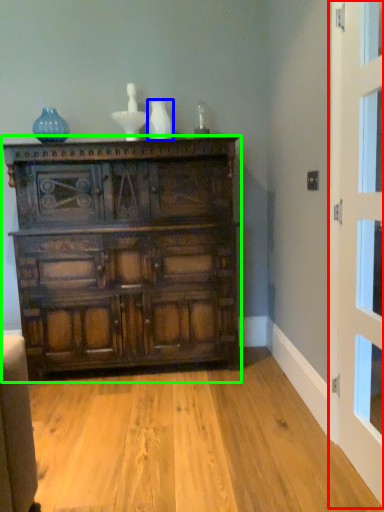
Question: Which object is the closest to the door (highlighted by a red box)? Choose among these: vase (highlighted by a blue box) or chest of drawers (highlighted by a green box).

Choices:
 (A) vase
 (B) chest of drawers

Answer: (B)